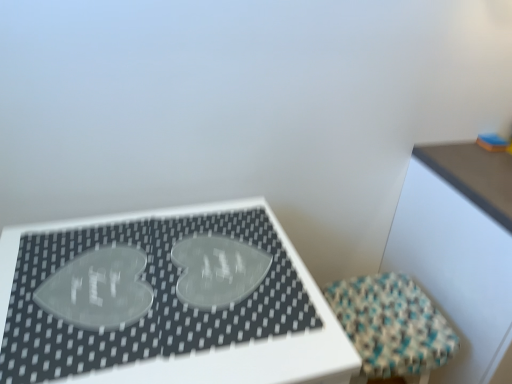
Describe the element at coordinates (460, 251) in the screenshot. I see `wooden table at upper right, the 2th table when ordered from left to right` at that location.

Where is `wooden table at upper right, the first table when ordered from right to left`? This screenshot has width=512, height=384. wooden table at upper right, the first table when ordered from right to left is located at coordinates (460, 251).

Identify the location of textured woven stool at lower right. This screenshot has width=512, height=384. point(391,325).

At what (x,y) coordinates should I click in order to perform the action: click on wooden table at upper right, the 2th table when ordered from left to right. Please return your answer as a coordinate pair (x, y). The image size is (512, 384). Looking at the image, I should click on (460, 251).

How much distance is there between wooden table at upper right, the first table when ordered from right to left, and textured woven stool at lower right?

22.55 centimeters.

Is wooden table at upper right, the first table when ordered from right to left, oriented away from textured woven stool at lower right?

No, wooden table at upper right, the first table when ordered from right to left,'s orientation is not away from textured woven stool at lower right.

Based on the photo, is wooden table at upper right, the first table when ordered from right to left, in front of or behind textured woven stool at lower right in the image?

wooden table at upper right, the first table when ordered from right to left, is positioned closer to the viewer than textured woven stool at lower right.

Locate an element on the screen. table that is the 2nd object located above the textured woven stool at lower right (from the image's perspective) is located at coordinates (460, 251).

Where is `furniture behind the wooden table at upper right, the 2th table when ordered from left to right`? The width and height of the screenshot is (512, 384). furniture behind the wooden table at upper right, the 2th table when ordered from left to right is located at coordinates (391, 325).

Would you say textured woven stool at lower right is outside wooden table at upper right, the first table when ordered from right to left?

Yes, textured woven stool at lower right is not within wooden table at upper right, the first table when ordered from right to left.

Which of these two, textured woven stool at lower right or wooden table at upper right, the 2th table when ordered from left to right, is bigger?

With larger size is wooden table at upper right, the 2th table when ordered from left to right.

Identify the location of table on the left of textured woven stool at lower right. The height and width of the screenshot is (384, 512). (170, 309).

In terms of size, does transparent pet heart at center, marked as the second table in a right-to-left arrangement, appear bigger or smaller than textured woven stool at lower right?

transparent pet heart at center, marked as the second table in a right-to-left arrangement, is bigger than textured woven stool at lower right.

Does transparent pet heart at center, marked as the second table in a right-to-left arrangement, turn towards textured woven stool at lower right?

No, transparent pet heart at center, marked as the second table in a right-to-left arrangement, does not turn towards textured woven stool at lower right.

Which is nearer, (20, 334) or (510, 375)?

Positioned in front is point (20, 334).

Locate an element on the screen. The image size is (512, 384). table located underneath the wooden table at upper right, the first table when ordered from right to left (from a real-world perspective) is located at coordinates (170, 309).

From the image's perspective, between transparent pet heart at center, placed as the 1th table when sorted from left to right, and wooden table at upper right, the first table when ordered from right to left, which one is located above?

wooden table at upper right, the first table when ordered from right to left, is shown above in the image.

Is textured woven stool at lower right smaller than transparent pet heart at center, marked as the second table in a right-to-left arrangement?

Indeed, textured woven stool at lower right has a smaller size compared to transparent pet heart at center, marked as the second table in a right-to-left arrangement.

Does textured woven stool at lower right have a greater height compared to transparent pet heart at center, marked as the second table in a right-to-left arrangement?

Incorrect, the height of textured woven stool at lower right is not larger of that of transparent pet heart at center, marked as the second table in a right-to-left arrangement.

Consider the image. Considering the relative positions of textured woven stool at lower right and transparent pet heart at center, marked as the second table in a right-to-left arrangement, in the image provided, is textured woven stool at lower right to the right of transparent pet heart at center, marked as the second table in a right-to-left arrangement, from the viewer's perspective?

Yes.

Is textured woven stool at lower right behind transparent pet heart at center, placed as the 1th table when sorted from left to right?

Yes, textured woven stool at lower right is further from the camera.

Where is `table located above the transparent pet heart at center, marked as the second table in a right-to-left arrangement (from a real-world perspective)`? This screenshot has width=512, height=384. table located above the transparent pet heart at center, marked as the second table in a right-to-left arrangement (from a real-world perspective) is located at coordinates (460, 251).

Consider the image. Is transparent pet heart at center, placed as the 1th table when sorted from left to right, at the back of wooden table at upper right, the 2th table when ordered from left to right?

No, transparent pet heart at center, placed as the 1th table when sorted from left to right, is not at the back of wooden table at upper right, the 2th table when ordered from left to right.

Considering the positions of objects wooden table at upper right, the first table when ordered from right to left, and transparent pet heart at center, placed as the 1th table when sorted from left to right, in the image provided, who is in front, wooden table at upper right, the first table when ordered from right to left, or transparent pet heart at center, placed as the 1th table when sorted from left to right,?

transparent pet heart at center, placed as the 1th table when sorted from left to right.

Is wooden table at upper right, the 2th table when ordered from left to right, to the right of transparent pet heart at center, marked as the second table in a right-to-left arrangement, from the viewer's perspective?

Yes.

You are a GUI agent. You are given a task and a screenshot of the screen. Output one action in this format:
    pyautogui.click(x=<x>, y=<y>)
    Task: Click on the table that appears on the right of textured woven stool at lower right
    
    Given the screenshot: What is the action you would take?
    pyautogui.click(x=460, y=251)

From a real-world perspective, which table is the 2nd one above the textured woven stool at lower right? Please provide its 2D coordinates.

[(460, 251)]

Which object lies nearer to the anchor point wooden table at upper right, the 2th table when ordered from left to right, transparent pet heart at center, placed as the 1th table when sorted from left to right, or textured woven stool at lower right?

textured woven stool at lower right is positioned closer to the anchor wooden table at upper right, the 2th table when ordered from left to right.

Which object lies nearer to the anchor point textured woven stool at lower right, transparent pet heart at center, placed as the 1th table when sorted from left to right, or wooden table at upper right, the 2th table when ordered from left to right?

The object closer to textured woven stool at lower right is wooden table at upper right, the 2th table when ordered from left to right.

Based on their spatial positions, is textured woven stool at lower right or transparent pet heart at center, marked as the second table in a right-to-left arrangement, closer to wooden table at upper right, the 2th table when ordered from left to right?

Based on the image, textured woven stool at lower right appears to be nearer to wooden table at upper right, the 2th table when ordered from left to right.

In the scene shown: From the image, which object appears to be nearer to transparent pet heart at center, marked as the second table in a right-to-left arrangement, textured woven stool at lower right or wooden table at upper right, the first table when ordered from right to left?

textured woven stool at lower right.

Estimate the real-world distances between objects in this image. Which object is further from textured woven stool at lower right, wooden table at upper right, the 2th table when ordered from left to right, or transparent pet heart at center, placed as the 1th table when sorted from left to right?

transparent pet heart at center, placed as the 1th table when sorted from left to right, is further to textured woven stool at lower right.

Considering their positions, is wooden table at upper right, the first table when ordered from right to left, positioned further to transparent pet heart at center, marked as the second table in a right-to-left arrangement, than textured woven stool at lower right?

Among the two, wooden table at upper right, the first table when ordered from right to left, is located further to transparent pet heart at center, marked as the second table in a right-to-left arrangement.

Where is `furniture situated between transparent pet heart at center, placed as the 1th table when sorted from left to right, and wooden table at upper right, the 2th table when ordered from left to right, from left to right`? furniture situated between transparent pet heart at center, placed as the 1th table when sorted from left to right, and wooden table at upper right, the 2th table when ordered from left to right, from left to right is located at coordinates (391, 325).